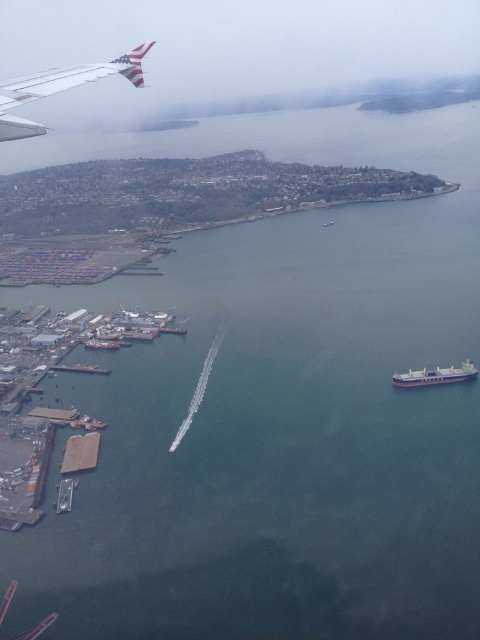
From the picture: Who is positioned more to the left, smooth concrete dock at lower left or metallic gray boat at lower left?

Positioned to the left is smooth concrete dock at lower left.

Can you confirm if smooth concrete dock at lower left is smaller than metallic gray boat at lower left?

Actually, smooth concrete dock at lower left might be larger than metallic gray boat at lower left.

You are a GUI agent. You are given a task and a screenshot of the screen. Output one action in this format:
    pyautogui.click(x=<x>, y=<y>)
    Task: Click on the smooth concrete dock at lower left
    
    Given the screenshot: What is the action you would take?
    pyautogui.click(x=81, y=452)

Where is `smooth concrete dock at lower left`? Image resolution: width=480 pixels, height=640 pixels. smooth concrete dock at lower left is located at coordinates (81, 452).

How much distance is there between white matte cargo ship at lower right and metallic gray boat at lower left?

white matte cargo ship at lower right is 252.76 meters away from metallic gray boat at lower left.

Can you confirm if white matte cargo ship at lower right is shorter than metallic gray boat at lower left?

No, white matte cargo ship at lower right is not shorter than metallic gray boat at lower left.

Describe the element at coordinates (434, 376) in the screenshot. The image size is (480, 640). I see `white matte cargo ship at lower right` at that location.

Identify the location of white matte cargo ship at lower right. This screenshot has width=480, height=640. (434, 376).

Can you confirm if metallic silver wing at upper left is positioned below white matte cargo ship at lower right?

Incorrect, metallic silver wing at upper left is not positioned below white matte cargo ship at lower right.

Does metallic silver wing at upper left appear on the left side of white matte cargo ship at lower right?

Indeed, metallic silver wing at upper left is positioned on the left side of white matte cargo ship at lower right.

This screenshot has height=640, width=480. I want to click on metallic silver wing at upper left, so 60,88.